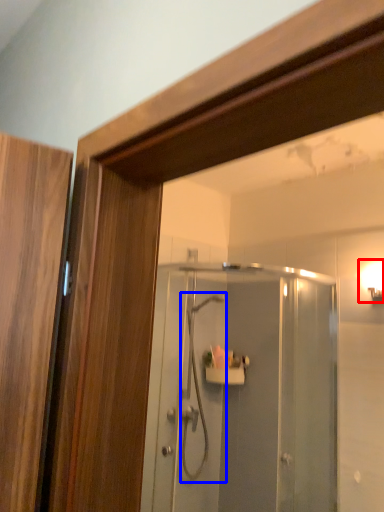
Question: Which object appears closest to the camera in this image, light fixture (highlighted by a red box) or shower (highlighted by a blue box)?

Choices:
 (A) light fixture
 (B) shower

Answer: (A)